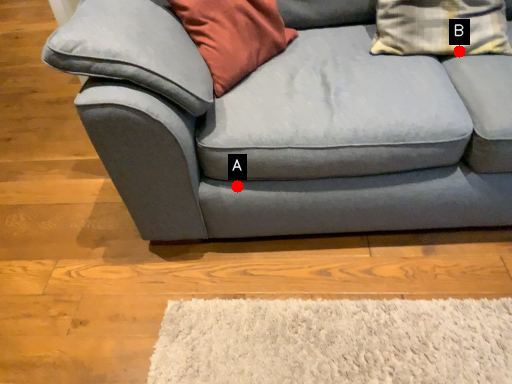
Question: Two points are circled on the image, labeled by A and B beside each circle. Which point appears farthest from the camera in this image?

Choices:
 (A) A is further
 (B) B is further

Answer: (B)